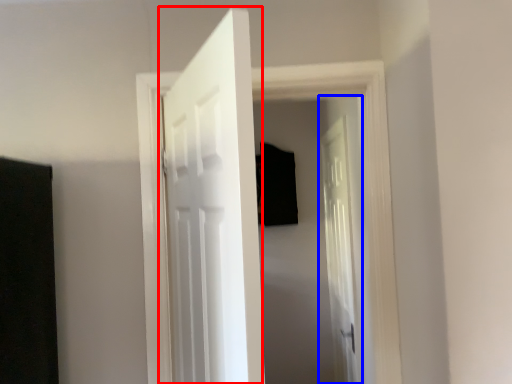
Question: Which point is further to the camera, door (highlighted by a red box) or door (highlighted by a blue box)?

Choices:
 (A) door
 (B) door

Answer: (B)